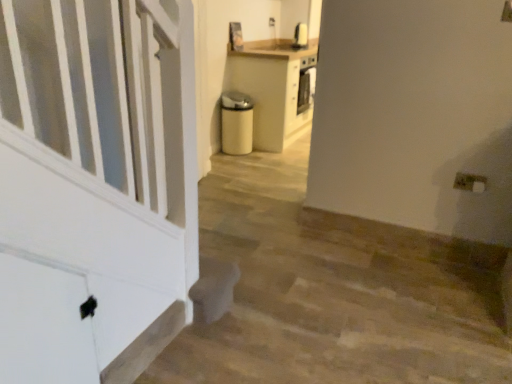
This screenshot has height=384, width=512. Identify the location of white plastic electric outlet at lower right. (470, 182).

What is the approximate height of white plastic electric outlet at lower right?

4.34 inches.

What is the approximate width of white plastic electric outlet at lower right?

The width of white plastic electric outlet at lower right is 1.36 inches.

What do you see at coordinates (470, 182) in the screenshot? I see `white plastic electric outlet at lower right` at bounding box center [470, 182].

What do you see at coordinates (145, 347) in the screenshot? Image resolution: width=512 pixels, height=384 pixels. I see `white matte stairwell at lower left` at bounding box center [145, 347].

The height and width of the screenshot is (384, 512). In order to click on white matte stairwell at lower left in this screenshot , I will do `click(145, 347)`.

From the picture: What is the approximate width of white matte stairwell at lower left?

white matte stairwell at lower left is 1.32 inches wide.

What are the coordinates of `white plastic electric outlet at lower right` in the screenshot? It's located at coord(470,182).

Considering the relative positions of white matte stairwell at lower left and white plastic electric outlet at lower right in the image provided, is white matte stairwell at lower left to the right of white plastic electric outlet at lower right from the viewer's perspective?

In fact, white matte stairwell at lower left is to the left of white plastic electric outlet at lower right.

Which object is further away from the camera taking this photo, white matte stairwell at lower left or white plastic electric outlet at lower right?

white plastic electric outlet at lower right is further from the camera.

Is point (131, 367) positioned after point (462, 185)?

No, (131, 367) is in front of (462, 185).

From the image's perspective, is white matte stairwell at lower left over white plastic electric outlet at lower right?

Actually, white matte stairwell at lower left appears below white plastic electric outlet at lower right in the image.

From a real-world perspective, is white matte stairwell at lower left above or below white plastic electric outlet at lower right?

In terms of real-world spatial position, white matte stairwell at lower left is below white plastic electric outlet at lower right.

Considering the relative sizes of white matte stairwell at lower left and white plastic electric outlet at lower right in the image provided, is white matte stairwell at lower left wider than white plastic electric outlet at lower right?

In fact, white matte stairwell at lower left might be narrower than white plastic electric outlet at lower right.

Can you confirm if white matte stairwell at lower left is taller than white plastic electric outlet at lower right?

Correct, white matte stairwell at lower left is much taller as white plastic electric outlet at lower right.

Considering the sizes of objects white matte stairwell at lower left and white plastic electric outlet at lower right in the image provided, who is bigger, white matte stairwell at lower left or white plastic electric outlet at lower right?

Bigger between the two is white matte stairwell at lower left.

Is white matte stairwell at lower left situated inside white plastic electric outlet at lower right or outside?

white matte stairwell at lower left cannot be found inside white plastic electric outlet at lower right.

Does white matte stairwell at lower left touch white plastic electric outlet at lower right?

No, white matte stairwell at lower left is not beside white plastic electric outlet at lower right.

Is white matte stairwell at lower left oriented away from white plastic electric outlet at lower right?

No, white matte stairwell at lower left is not facing the opposite direction of white plastic electric outlet at lower right.

Based on the photo, how different are the orientations of white matte stairwell at lower left and white plastic electric outlet at lower right in degrees?

The angular difference between white matte stairwell at lower left and white plastic electric outlet at lower right is 87.9 degrees.

At what (x,y) coordinates should I click in order to perform the action: click on electric outlet above the white matte stairwell at lower left (from a real-world perspective). Please return your answer as a coordinate pair (x, y). Looking at the image, I should click on (470, 182).

Which object is positioned more to the left, white plastic electric outlet at lower right or white matte stairwell at lower left?

Positioned to the left is white matte stairwell at lower left.

Relative to white matte stairwell at lower left, is white plastic electric outlet at lower right in front or behind?

white plastic electric outlet at lower right is behind white matte stairwell at lower left.

Considering the positions of points (485, 177) and (136, 343), is point (485, 177) farther from camera compared to point (136, 343)?

Yes.

From the image's perspective, is white plastic electric outlet at lower right over white matte stairwell at lower left?

Yes.

From a real-world perspective, is white plastic electric outlet at lower right under white matte stairwell at lower left?

No, from a real-world perspective, white plastic electric outlet at lower right is not beneath white matte stairwell at lower left.

In terms of width, does white plastic electric outlet at lower right look wider or thinner when compared to white matte stairwell at lower left?

white plastic electric outlet at lower right is wider than white matte stairwell at lower left.

Between white plastic electric outlet at lower right and white matte stairwell at lower left, which one has more height?

Standing taller between the two is white matte stairwell at lower left.

Which of these two, white plastic electric outlet at lower right or white matte stairwell at lower left, is smaller?

white plastic electric outlet at lower right is smaller.

Looking at this image, would you say white plastic electric outlet at lower right is outside white matte stairwell at lower left?

Yes, white plastic electric outlet at lower right is outside of white matte stairwell at lower left.

From the picture: Is white plastic electric outlet at lower right beside white matte stairwell at lower left?

white plastic electric outlet at lower right is not next to white matte stairwell at lower left, and they're not touching.

Is white matte stairwell at lower left at the back of white plastic electric outlet at lower right?

white plastic electric outlet at lower right is not turned away from white matte stairwell at lower left.

What's the angular difference between white plastic electric outlet at lower right and white matte stairwell at lower left's facing directions?

There is a 87.9-degree angle between the facing directions of white plastic electric outlet at lower right and white matte stairwell at lower left.

The image size is (512, 384). Find the location of `stairwell in front of the white plastic electric outlet at lower right`. stairwell in front of the white plastic electric outlet at lower right is located at coordinates (145, 347).

Where is `electric outlet lying above the white matte stairwell at lower left (from the image's perspective)`? This screenshot has width=512, height=384. electric outlet lying above the white matte stairwell at lower left (from the image's perspective) is located at coordinates (470, 182).

Find the location of a particular element. The image size is (512, 384). electric outlet above the white matte stairwell at lower left (from a real-world perspective) is located at coordinates (470, 182).